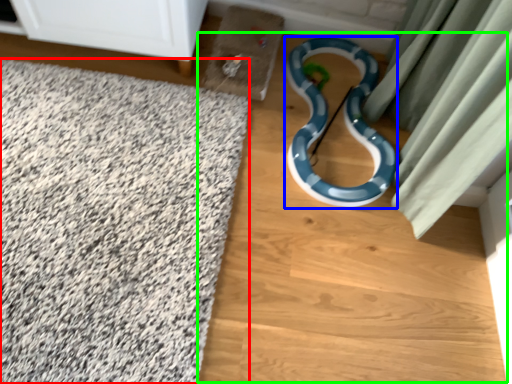
Question: Which object is positioned farthest from bath mat (highlighted by a red box)? Select from snake (highlighted by a blue box) and dirt track (highlighted by a green box).

Choices:
 (A) snake
 (B) dirt track

Answer: (A)